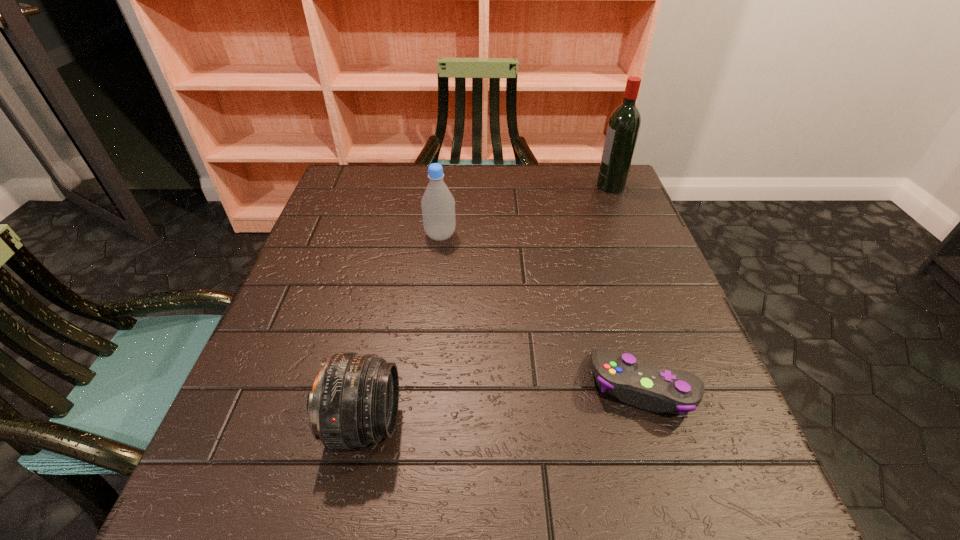
This screenshot has height=540, width=960. In order to click on the farthest object in this screenshot , I will do `click(624, 124)`.

Where is `the tallest object`? the tallest object is located at coordinates (624, 124).

The image size is (960, 540). Identify the location of the third nearest object. (438, 204).

I want to click on the second tallest object, so click(x=438, y=204).

At what (x,y) coordinates should I click in order to perform the action: click on the third tallest object. Please return your answer as a coordinate pair (x, y). Looking at the image, I should click on (354, 402).

This screenshot has height=540, width=960. In order to click on the shortest object in this screenshot , I will do 646,386.

At what (x,y) coordinates should I click in order to perform the action: click on free region located on the label of the wine bottle. Please return your answer as a coordinate pair (x, y). This screenshot has width=960, height=540. Looking at the image, I should click on coord(575,186).

I want to click on vacant area situated 0.160m on the label of the wine bottle, so click(539, 186).

Where is `vacant space located 0.310m on the label of the wine bottle`? This screenshot has width=960, height=540. vacant space located 0.310m on the label of the wine bottle is located at coordinates (485, 186).

Locate an element on the screen. vacant region located 0.130m on the right of the bottle is located at coordinates (511, 235).